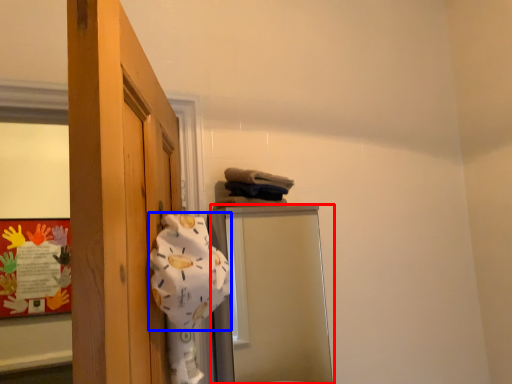
Question: Which point is closer to the camera, mirror (highlighted by a red box) or bath towel (highlighted by a blue box)?

Choices:
 (A) mirror
 (B) bath towel

Answer: (B)